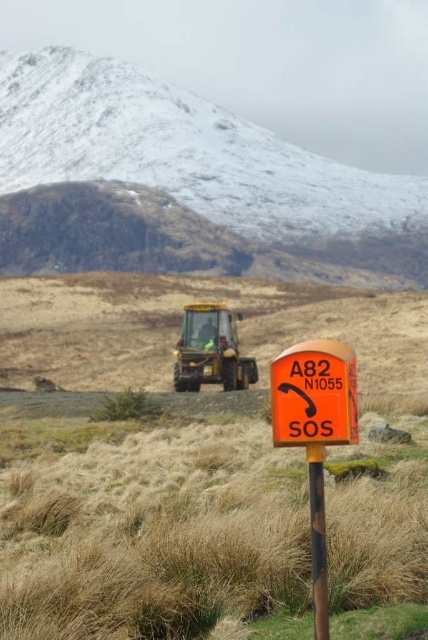
You are a hiker who wants to take a photo of the snowy rock mountain at upper left and the brown wood post at center. Which object should you focus on first if you want to capture both in the same frame without moving your camera?

The snowy rock mountain at upper left is much taller than the brown wood post at center, so you should focus on the snowy rock mountain at upper left first to ensure it fits entirely in the frame.

You are a hiker who needs to reach the snowy rock mountain at upper left from the yellow metallic tractor at center. Can you walk directly between them without needing to go around any obstacles?

The snowy rock mountain at upper left and yellow metallic tractor at center are 80.32 meters apart, so yes, you can walk directly between them since there are no obstacles mentioned in the scene description.